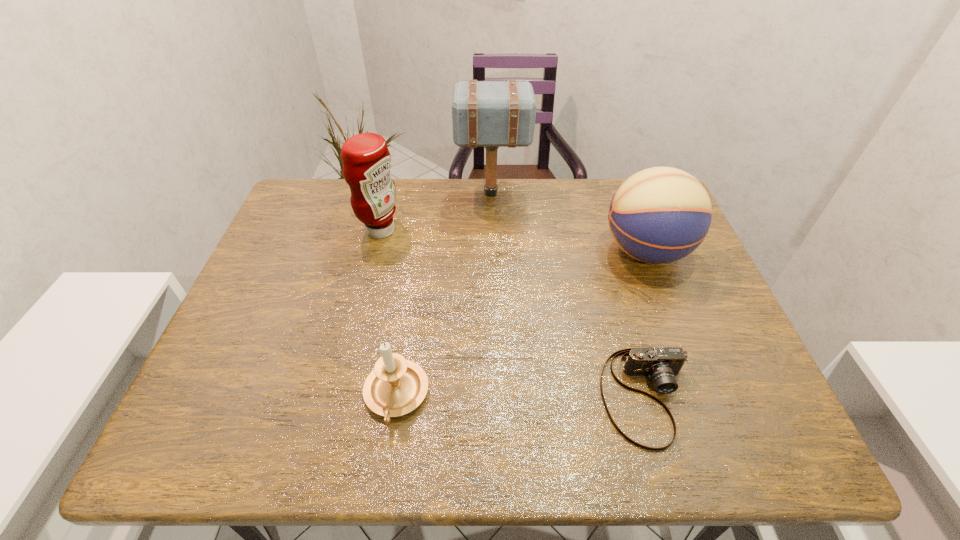
Locate an element on the screen. object that is at the far right corner is located at coordinates (659, 215).

Locate an element on the screen. object that is at the near right corner is located at coordinates (661, 365).

In the image, there is a desktop. At what (x,y) coordinates should I click in order to perform the action: click on vacant space at the far edge. Please return your answer as a coordinate pair (x, y). Looking at the image, I should click on (600, 213).

In order to click on free region at the near edge of the desktop in this screenshot , I will do (605, 456).

Where is `vacant area at the left edge`? The image size is (960, 540). vacant area at the left edge is located at coordinates (264, 367).

At what (x,y) coordinates should I click in order to perform the action: click on blank space at the right edge of the desktop. Please return your answer as a coordinate pair (x, y). This screenshot has width=960, height=540. Looking at the image, I should click on (684, 329).

In the image, there is a desktop. Identify the location of vacant space at the far left corner. (317, 192).

Locate an element on the screen. Image resolution: width=960 pixels, height=540 pixels. free space between the shortest object and the third object from left to right is located at coordinates (569, 295).

Where is `empty space between the basketball and the second shortest object`? Image resolution: width=960 pixels, height=540 pixels. empty space between the basketball and the second shortest object is located at coordinates (520, 324).

This screenshot has width=960, height=540. In order to click on empty space that is in between the shortest object and the basketball in this screenshot , I will do `click(646, 323)`.